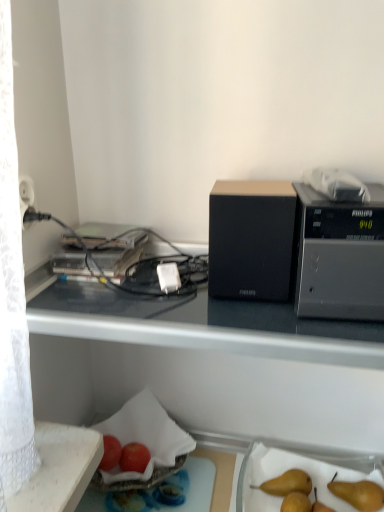
Find the location of a particular element. The width and height of the screenshot is (384, 512). white plastic power plug at center is located at coordinates (168, 277).

At what (x,y) coordinates should I click in order to perform the action: click on red matte apple at lower left, the second apple viewed from the right. Please return your answer as a coordinate pair (x, y). Image resolution: width=384 pixels, height=512 pixels. Looking at the image, I should click on (110, 453).

Locate an element on the screen. This screenshot has width=384, height=512. black plastic microwave at upper right, the first appliance positioned from the right is located at coordinates (339, 256).

Is black plastic microwave at upper right, the first appliance positioned from the right, at the right side of brown matte pear at lower right?

No.

Is black plastic microwave at upper right, positioned as the second appliance in left-to-right order, further to the viewer compared to brown matte pear at lower right?

No, it is not.

From the image's perspective, is black plastic microwave at upper right, positioned as the second appliance in left-to-right order, positioned above or below brown matte pear at lower right?

Based on their image positions, black plastic microwave at upper right, positioned as the second appliance in left-to-right order, is located above brown matte pear at lower right.

From the image's perspective, which is above, black plastic microwave at upper right, the first appliance positioned from the right, or red matte apple at lower left, the second apple viewed from the right?

black plastic microwave at upper right, the first appliance positioned from the right, appears higher in the image.

Looking at this image, considering the relative sizes of black plastic microwave at upper right, the first appliance positioned from the right, and red matte apple at lower left, the second apple viewed from the right, in the image provided, is black plastic microwave at upper right, the first appliance positioned from the right, smaller than red matte apple at lower left, the second apple viewed from the right,?

Incorrect, black plastic microwave at upper right, the first appliance positioned from the right, is not smaller in size than red matte apple at lower left, the second apple viewed from the right.

Is black plastic microwave at upper right, positioned as the second appliance in left-to-right order, turned away from red matte apple at lower left, the second apple viewed from the right?

No.

What's the angular difference between black plastic microwave at upper right, positioned as the second appliance in left-to-right order, and red matte apple at lower left, the first apple viewed from the left,'s facing directions?

2.86 degrees.

Would you consider black matte desk at upper center to be distant from black plastic microwave at upper right, positioned as the second appliance in left-to-right order?

No.

Considering the positions of objects black matte desk at upper center and black plastic microwave at upper right, the first appliance positioned from the right, in the image provided, who is more to the left, black matte desk at upper center or black plastic microwave at upper right, the first appliance positioned from the right,?

From the viewer's perspective, black matte desk at upper center appears more on the left side.

Between black matte desk at upper center and black plastic microwave at upper right, the first appliance positioned from the right, which one has larger width?

black matte desk at upper center.

Is black plastic microwave at upper right, positioned as the second appliance in left-to-right order, bigger than red matte apple at lower center, placed as the 2th apple when sorted from left to right?

Yes.

Would you say black plastic microwave at upper right, positioned as the second appliance in left-to-right order, is inside or outside red matte apple at lower center, which appears as the 1th apple when viewed from the right?

black plastic microwave at upper right, positioned as the second appliance in left-to-right order, is outside red matte apple at lower center, which appears as the 1th apple when viewed from the right.

Which of these two, black plastic microwave at upper right, the first appliance positioned from the right, or red matte apple at lower center, which appears as the 1th apple when viewed from the right, is wider?

black plastic microwave at upper right, the first appliance positioned from the right, is wider.

Which of these two, black plastic microwave at upper right, the first appliance positioned from the right, or red matte apple at lower center, placed as the 2th apple when sorted from left to right, stands taller?

Standing taller between the two is black plastic microwave at upper right, the first appliance positioned from the right.

In the scene shown: Can you confirm if red matte apple at lower center, which appears as the 1th apple when viewed from the right, is bigger than red matte apple at lower left, the second apple viewed from the right?

Actually, red matte apple at lower center, which appears as the 1th apple when viewed from the right, might be smaller than red matte apple at lower left, the second apple viewed from the right.

Locate an element on the screen. This screenshot has height=512, width=384. apple below the red matte apple at lower left, the second apple viewed from the right (from a real-world perspective) is located at coordinates (134, 457).

Could you tell me if red matte apple at lower center, which appears as the 1th apple when viewed from the right, is facing red matte apple at lower left, the second apple viewed from the right?

No.

Is red matte apple at lower left, the second apple viewed from the right, thinner than black plastic microwave at upper right, the first appliance positioned from the right?

Correct, the width of red matte apple at lower left, the second apple viewed from the right, is less than that of black plastic microwave at upper right, the first appliance positioned from the right.

Is the surface of red matte apple at lower left, the second apple viewed from the right, in direct contact with black plastic microwave at upper right, positioned as the second appliance in left-to-right order?

No, red matte apple at lower left, the second apple viewed from the right, is not making contact with black plastic microwave at upper right, positioned as the second appliance in left-to-right order.

From the picture: Measure the distance between red matte apple at lower left, the second apple viewed from the right, and black plastic microwave at upper right, positioned as the second appliance in left-to-right order.

red matte apple at lower left, the second apple viewed from the right, and black plastic microwave at upper right, positioned as the second appliance in left-to-right order, are 60.59 centimeters apart from each other.

Is the depth of red matte apple at lower left, the second apple viewed from the right, less than that of black plastic microwave at upper right, the first appliance positioned from the right?

No, red matte apple at lower left, the second apple viewed from the right, is behind black plastic microwave at upper right, the first appliance positioned from the right.

Is black matte desk at upper center wider than brown matte pear at lower right?

Yes, black matte desk at upper center is wider than brown matte pear at lower right.

Considering the relative sizes of black matte desk at upper center and brown matte pear at lower right in the image provided, is black matte desk at upper center shorter than brown matte pear at lower right?

No, black matte desk at upper center is not shorter than brown matte pear at lower right.

From a real-world perspective, who is located lower, black matte desk at upper center or brown matte pear at lower right?

brown matte pear at lower right is physically lower.

Find the location of `the 1st appliance to the left of the brown matte pear at lower right, counting from the anchor's position`. the 1st appliance to the left of the brown matte pear at lower right, counting from the anchor's position is located at coordinates (339, 256).

Where is `the 1st appliance directly above the red matte apple at lower left, the first apple viewed from the left (from a real-world perspective)`? This screenshot has height=512, width=384. the 1st appliance directly above the red matte apple at lower left, the first apple viewed from the left (from a real-world perspective) is located at coordinates click(x=339, y=256).

Based on their spatial positions, is black fabric speaker at center, which is the first appliance in left-to-right order, or black matte desk at upper center further from red matte apple at lower center, which appears as the 1th apple when viewed from the right?

Based on the image, black fabric speaker at center, which is the first appliance in left-to-right order, appears to be further to red matte apple at lower center, which appears as the 1th apple when viewed from the right.

Considering their positions, is black plastic microwave at upper right, positioned as the second appliance in left-to-right order, positioned further to white plastic power plug at center than black matte desk at upper center?

The object further to white plastic power plug at center is black matte desk at upper center.

Which object lies nearer to the anchor point white plastic power plug at center, red matte apple at lower center, which appears as the 1th apple when viewed from the right, or black matte desk at upper center?

black matte desk at upper center is positioned closer to the anchor white plastic power plug at center.

Which object lies further to the anchor point black matte desk at upper center, red matte apple at lower center, placed as the 2th apple when sorted from left to right, or brown matte pear at lower right?

brown matte pear at lower right lies further to black matte desk at upper center than the other object.

When comparing their distances from red matte apple at lower left, the second apple viewed from the right, does black plastic microwave at upper right, the first appliance positioned from the right, or black fabric speaker at center, which is the first appliance in left-to-right order, seem further?

Among the two, black plastic microwave at upper right, the first appliance positioned from the right, is located further to red matte apple at lower left, the second apple viewed from the right.

From the image, which object appears to be nearer to red matte apple at lower left, the first apple viewed from the left, red matte apple at lower center, placed as the 2th apple when sorted from left to right, or brown matte pear at lower right?

Based on the image, red matte apple at lower center, placed as the 2th apple when sorted from left to right, appears to be nearer to red matte apple at lower left, the first apple viewed from the left.

Considering their positions, is black plastic microwave at upper right, the first appliance positioned from the right, positioned further to black fabric speaker at center, the 2th appliance viewed from the right, than black matte desk at upper center?

black matte desk at upper center is further to black fabric speaker at center, the 2th appliance viewed from the right.

Based on their spatial positions, is black fabric speaker at center, the 2th appliance viewed from the right, or white plastic power plug at center further from red matte apple at lower center, placed as the 2th apple when sorted from left to right?

Based on the image, black fabric speaker at center, the 2th appliance viewed from the right, appears to be further to red matte apple at lower center, placed as the 2th apple when sorted from left to right.

Where is `power plugs and sockets between black fabric speaker at center, the 2th appliance viewed from the right, and brown matte pear at lower right, in the vertical direction`? The height and width of the screenshot is (512, 384). power plugs and sockets between black fabric speaker at center, the 2th appliance viewed from the right, and brown matte pear at lower right, in the vertical direction is located at coordinates (168, 277).

Image resolution: width=384 pixels, height=512 pixels. I want to click on apple between black plastic microwave at upper right, the first appliance positioned from the right, and red matte apple at lower center, which appears as the 1th apple when viewed from the right, vertically, so point(110,453).

Locate an element on the screen. This screenshot has width=384, height=512. desk that lies between black fabric speaker at center, which is the first appliance in left-to-right order, and brown matte pear at lower right from top to bottom is located at coordinates (210, 367).

At what (x,y) coordinates should I click in order to perform the action: click on power plugs and sockets between red matte apple at lower left, the second apple viewed from the right, and brown matte pear at lower right. Please return your answer as a coordinate pair (x, y). The height and width of the screenshot is (512, 384). Looking at the image, I should click on (168, 277).